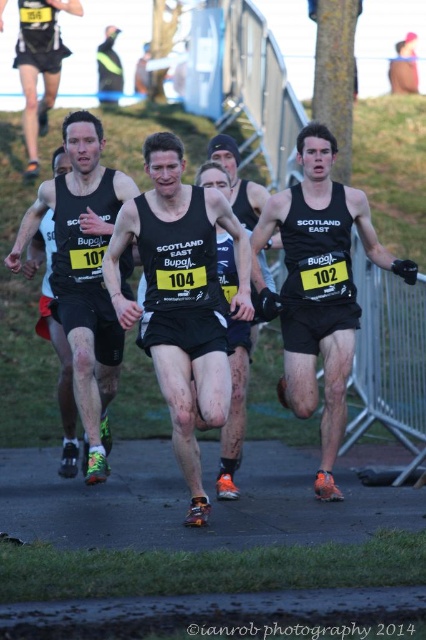
Question: Can you confirm if matte black shorts at center is wider than matte black tank top at center?

Choices:
 (A) no
 (B) yes

Answer: (B)

Question: Based on their relative distances, which object is farther from the black matte singlet at center?

Choices:
 (A) black matte tank top at center
 (B) matte black tank top at center
 (C) matte black shorts at center
 (D) matte black tank top at upper left

Answer: (D)

Question: Based on their relative distances, which object is farther from the matte black shorts at center?

Choices:
 (A) matte black singlet at center
 (B) matte black tank top at center
 (C) matte black tank top at upper left

Answer: (C)

Question: Which of the following is the farthest from the observer?

Choices:
 (A) (58, 358)
 (B) (244, 342)
 (C) (97, 138)

Answer: (A)

Question: Is black matte singlet at center behind matte black shorts at center?

Choices:
 (A) no
 (B) yes

Answer: (B)

Question: Does black matte tank top at center lie behind matte black tank top at center?

Choices:
 (A) yes
 (B) no

Answer: (B)